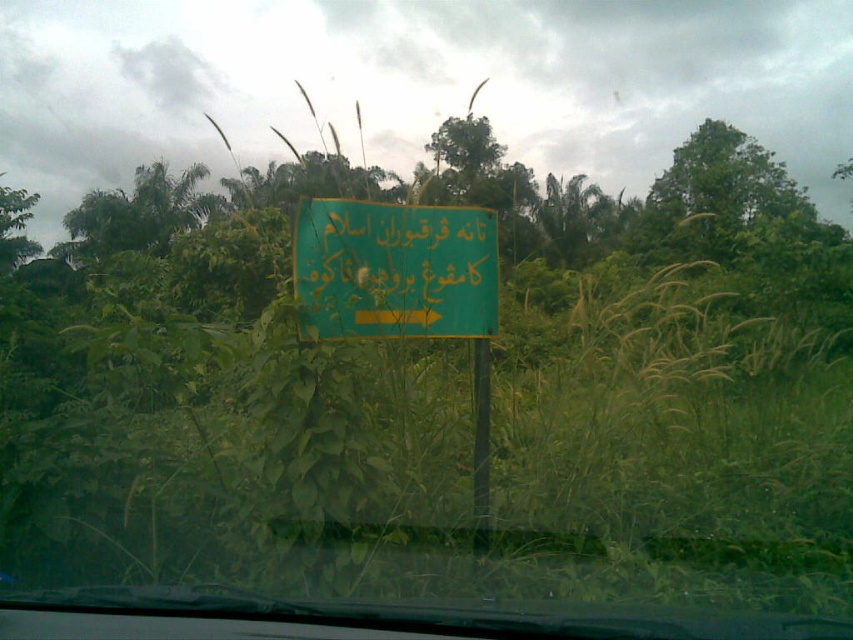
Question: Does green leafy tree at upper right appear on the right side of green plastic pole at center?

Choices:
 (A) no
 (B) yes

Answer: (B)

Question: Which point is farther to the camera?

Choices:
 (A) green leafy tree at upper right
 (B) green plastic pole at center
 (C) green matte sign at center

Answer: (A)

Question: Can you confirm if green matte sign at center is positioned above green plastic pole at center?

Choices:
 (A) no
 (B) yes

Answer: (B)

Question: Among these points, which one is nearest to the camera?

Choices:
 (A) (476, 416)
 (B) (770, 157)

Answer: (A)

Question: Does green matte sign at center have a larger size compared to green leafy tree at upper right?

Choices:
 (A) no
 (B) yes

Answer: (A)

Question: Which object is farther from the camera taking this photo?

Choices:
 (A) green plastic pole at center
 (B) green leafy tree at upper right
 (C) green matte sign at center

Answer: (B)